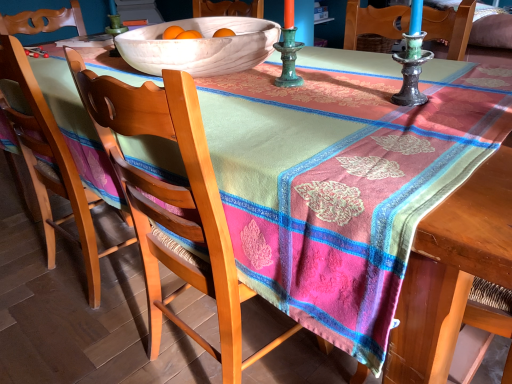
Question: Is the depth of wooden chair at center, acting as the 1th chair starting from the right, greater than that of wooden chair at left, which ranks as the second chair in right-to-left order?

Choices:
 (A) no
 (B) yes

Answer: (A)

Question: Does wooden chair at center, acting as the 1th chair starting from the right, appear on the right side of wooden chair at left, which ranks as the second chair in right-to-left order?

Choices:
 (A) no
 (B) yes

Answer: (B)

Question: Does wooden chair at center, acting as the 1th chair starting from the right, turn towards wooden chair at left, positioned as the 1th chair in left-to-right order?

Choices:
 (A) no
 (B) yes

Answer: (A)

Question: Would you consider wooden chair at center, the 2th chair from the left, to be distant from wooden chair at left, which ranks as the second chair in right-to-left order?

Choices:
 (A) yes
 (B) no

Answer: (B)

Question: From a real-world perspective, does wooden chair at center, acting as the 1th chair starting from the right, sit lower than wooden chair at left, positioned as the 1th chair in left-to-right order?

Choices:
 (A) no
 (B) yes

Answer: (B)

Question: Relative to white ceramic bowl at upper center, is wooden chair at left, positioned as the 1th chair in left-to-right order, in front or behind?

Choices:
 (A) behind
 (B) front

Answer: (A)

Question: From a real-world perspective, is wooden chair at left, positioned as the 1th chair in left-to-right order, physically located above or below white ceramic bowl at upper center?

Choices:
 (A) above
 (B) below

Answer: (B)

Question: Considering the positions of wooden chair at left, positioned as the 1th chair in left-to-right order, and white ceramic bowl at upper center in the image, is wooden chair at left, positioned as the 1th chair in left-to-right order, bigger or smaller than white ceramic bowl at upper center?

Choices:
 (A) big
 (B) small

Answer: (A)

Question: Is wooden chair at left, which ranks as the second chair in right-to-left order, wider or thinner than white ceramic bowl at upper center?

Choices:
 (A) thin
 (B) wide

Answer: (A)

Question: Is wooden chair at center, the 2th chair from the left, in front of or behind white ceramic bowl at upper center in the image?

Choices:
 (A) front
 (B) behind

Answer: (A)

Question: Is point (147, 283) positioned closer to the camera than point (185, 48)?

Choices:
 (A) farther
 (B) closer

Answer: (A)

Question: In the image, is wooden chair at center, the 2th chair from the left, on the left side or the right side of white ceramic bowl at upper center?

Choices:
 (A) left
 (B) right

Answer: (B)

Question: Is wooden chair at center, acting as the 1th chair starting from the right, spatially inside white ceramic bowl at upper center, or outside of it?

Choices:
 (A) outside
 (B) inside

Answer: (A)

Question: Is point (80, 195) positioned closer to the camera than point (147, 263)?

Choices:
 (A) closer
 (B) farther

Answer: (B)

Question: Based on their positions, is wooden chair at left, which ranks as the second chair in right-to-left order, located to the left or right of wooden chair at center, the 2th chair from the left?

Choices:
 (A) left
 (B) right

Answer: (A)